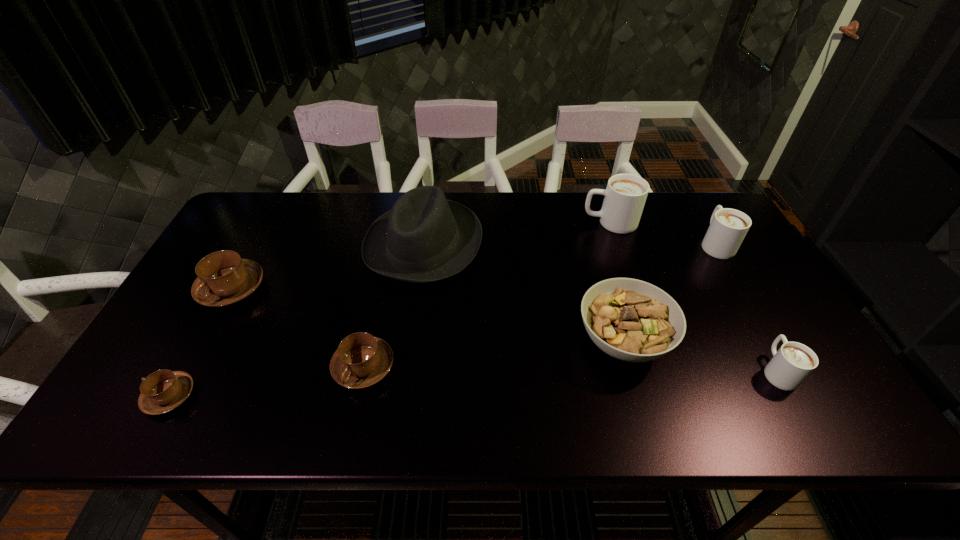
This screenshot has width=960, height=540. I want to click on vacant region that satisfies the following two spatial constraints: 1. on the side with the handle of the smallest white cappuccino; 2. on the side with the handle of the leftmost white cappuccino, so click(695, 222).

At what (x,y) coordinates should I click in order to perform the action: click on vacant space that satisfies the following two spatial constraints: 1. on the side of the third farthest cappuccino with the handle; 2. on the side of the shortest object with the handle. Please return your answer as a coordinate pair (x, y). Looking at the image, I should click on tap(173, 396).

At what (x,y) coordinates should I click in order to perform the action: click on free spot that satisfies the following two spatial constraints: 1. on the side with the handle of the third cappuccino from right to left; 2. on the side with the handle of the nearest white cappuccino. Please return your answer as a coordinate pair (x, y). This screenshot has height=540, width=960. Looking at the image, I should click on (660, 370).

Find the location of a particular element. free region that satisfies the following two spatial constraints: 1. on the side with the handle of the biggest white cappuccino; 2. on the side with the handle of the smallest white cappuccino is located at coordinates (660, 370).

Locate an element on the screen. Image resolution: width=960 pixels, height=540 pixels. vacant space that satisfies the following two spatial constraints: 1. on the side of the fifth tallest cappuccino with the handle; 2. on the side of the shortest object with the handle is located at coordinates (357, 396).

This screenshot has width=960, height=540. I want to click on free space that satisfies the following two spatial constraints: 1. on the front side of the gray stew; 2. on the left side of the fedora, so click(411, 341).

This screenshot has width=960, height=540. In order to click on vacant area that satisfies the following two spatial constraints: 1. on the side with the handle of the smallest white cappuccino; 2. on the side with the handle of the biggest white cappuccino in this screenshot , I will do `click(695, 222)`.

Identify the location of free space in the image that satisfies the following two spatial constraints: 1. on the side with the handle of the fourth cappuccino from left to right; 2. on the side with the handle of the second smallest white cappuccino. The width and height of the screenshot is (960, 540). (616, 244).